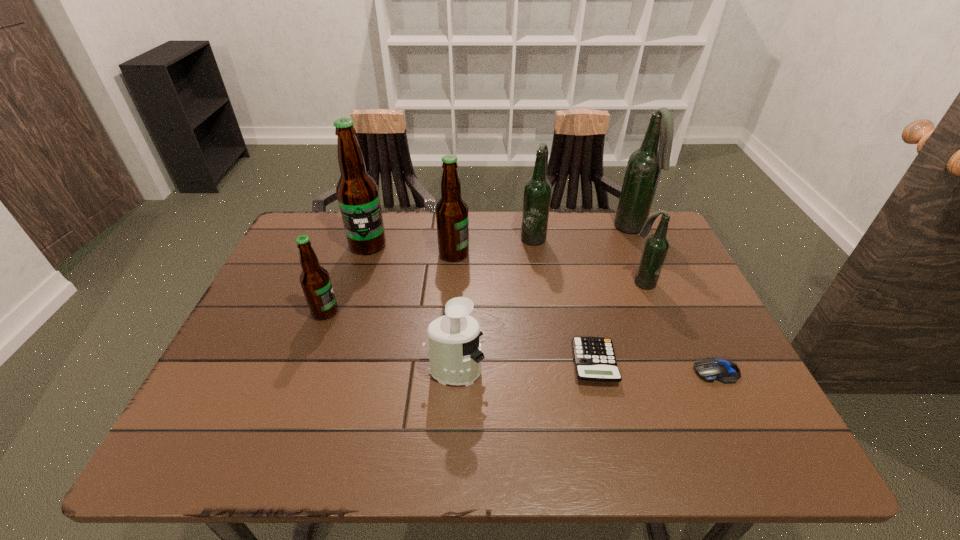
This screenshot has width=960, height=540. I want to click on juicer, so click(455, 355).

Where is `calculator`? The image size is (960, 540). calculator is located at coordinates (594, 357).

Identify the location of computer mouse. (710, 369).

Where is `free spot located on the front of the biggest dark beer bottle`? This screenshot has width=960, height=540. free spot located on the front of the biggest dark beer bottle is located at coordinates (681, 341).

Identify the location of free space located on the label of the biggest brown beer bottle. This screenshot has height=540, width=960. (351, 298).

At what (x,y) coordinates should I click in order to perform the action: click on vacant space situated 0.240m on the front of the leftmost dark beer bottle. Please return your answer as a coordinate pair (x, y). Looking at the image, I should click on (543, 303).

Where is `vacant region located 0.340m on the label of the rightmost brown beer bottle`? The height and width of the screenshot is (540, 960). vacant region located 0.340m on the label of the rightmost brown beer bottle is located at coordinates (588, 254).

This screenshot has width=960, height=540. Find the location of `free region located on the label of the nearest brown beer bottle`. free region located on the label of the nearest brown beer bottle is located at coordinates (371, 312).

Where is `vacant space located 0.210m on the front of the smallest dark beer bottle`? The image size is (960, 540). vacant space located 0.210m on the front of the smallest dark beer bottle is located at coordinates click(x=671, y=354).

This screenshot has width=960, height=540. I want to click on vacant space located on the back of the juicer, so click(x=460, y=293).